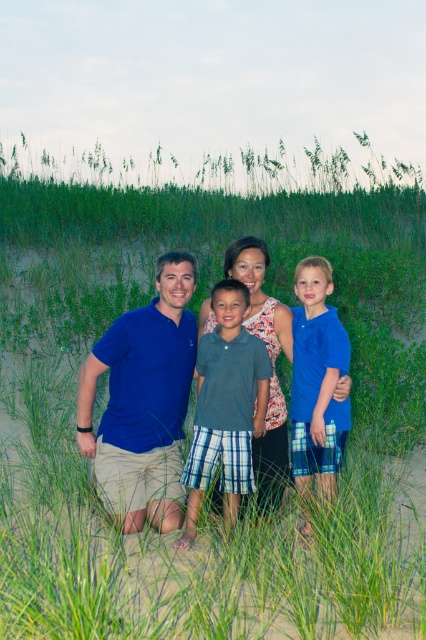
Between gray plaid shorts at center and blue cotton shirt at right, which one appears on the left side from the viewer's perspective?

gray plaid shorts at center

Does gray plaid shorts at center have a lesser width compared to blue cotton shirt at right?

In fact, gray plaid shorts at center might be wider than blue cotton shirt at right.

Between point (258, 401) and point (291, 468), which one is positioned behind?

The point (291, 468) is behind.

Identify the location of gray plaid shorts at center. (226, 406).

Based on the photo, does matte blue polo shirt at left lie behind blue cotton shirt at center?

No, matte blue polo shirt at left is in front of blue cotton shirt at center.

Between matte blue polo shirt at left and blue cotton shirt at center, which one is positioned lower?

matte blue polo shirt at left is lower down.

This screenshot has width=426, height=640. In order to click on matte blue polo shirt at left in this screenshot , I will do `click(143, 372)`.

Locate an element on the screen. matte blue polo shirt at left is located at coordinates (143, 372).

Looking at this image, between gray plaid shorts at center and blue cotton shirt at center, which one is positioned higher?

blue cotton shirt at center is above.

Is gray plaid shorts at center closer to camera compared to blue cotton shirt at center?

That is True.

Is point (256, 419) behind point (86, 416)?

That is True.

Identify the location of gray plaid shorts at center. (226, 406).